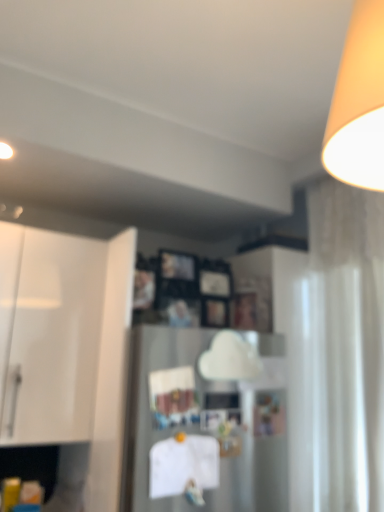
Question: Is satin silver refrigerator at center far from white glossy cabinet at left?

Choices:
 (A) yes
 (B) no

Answer: (B)

Question: Is satin silver refrigerator at center aimed at white glossy cabinet at left?

Choices:
 (A) no
 (B) yes

Answer: (A)

Question: Considering the relative sizes of satin silver refrigerator at center and white glossy cabinet at left in the image provided, is satin silver refrigerator at center bigger than white glossy cabinet at left?

Choices:
 (A) yes
 (B) no

Answer: (B)

Question: Is satin silver refrigerator at center closer to the viewer compared to white glossy cabinet at left?

Choices:
 (A) yes
 (B) no

Answer: (A)

Question: Does satin silver refrigerator at center have a smaller size compared to white glossy cabinet at left?

Choices:
 (A) yes
 (B) no

Answer: (A)

Question: In the image, is satin silver refrigerator at center on the left side or the right side of white sheer curtain at right?

Choices:
 (A) right
 (B) left

Answer: (B)

Question: From the image's perspective, is satin silver refrigerator at center positioned above or below white sheer curtain at right?

Choices:
 (A) above
 (B) below

Answer: (B)

Question: Considering their positions, is satin silver refrigerator at center located in front of or behind white sheer curtain at right?

Choices:
 (A) front
 (B) behind

Answer: (A)

Question: From a real-world perspective, relative to white sheer curtain at right, is satin silver refrigerator at center vertically above or below?

Choices:
 (A) above
 (B) below

Answer: (B)

Question: Is point (291, 454) positioned closer to the camera than point (11, 342)?

Choices:
 (A) farther
 (B) closer

Answer: (A)

Question: From a real-world perspective, relative to white glossy cabinet at left, is white sheer curtain at right vertically above or below?

Choices:
 (A) above
 (B) below

Answer: (A)

Question: In terms of size, does white sheer curtain at right appear bigger or smaller than white glossy cabinet at left?

Choices:
 (A) big
 (B) small

Answer: (B)

Question: In terms of width, does white sheer curtain at right look wider or thinner when compared to white glossy cabinet at left?

Choices:
 (A) wide
 (B) thin

Answer: (B)

Question: Would you say satin silver refrigerator at center is inside or outside white glossy cabinet at left?

Choices:
 (A) inside
 (B) outside

Answer: (B)

Question: Is satin silver refrigerator at center taller or shorter than white glossy cabinet at left?

Choices:
 (A) tall
 (B) short

Answer: (B)